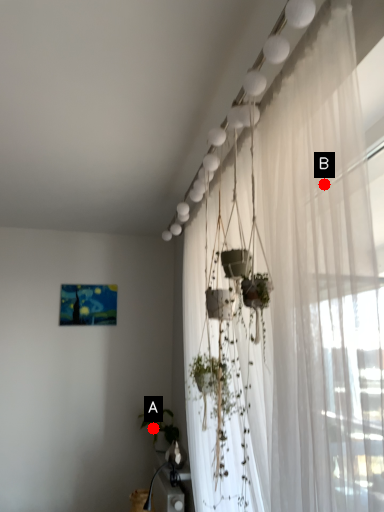
Question: Two points are circled on the image, labeled by A and B beside each circle. Which point appears closest to the camera in this image?

Choices:
 (A) A is closer
 (B) B is closer

Answer: (B)